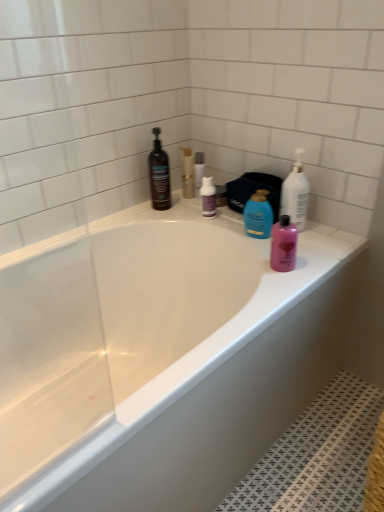
You are a GUI agent. You are given a task and a screenshot of the screen. Output one action in this format:
    pyautogui.click(x=<x>, y=<y>)
    Task: Click on the free location in front of white glossy bottle at upper right, which ranks as the first cleaning product in right-to-left order
    
    Given the screenshot: What is the action you would take?
    pyautogui.click(x=311, y=248)